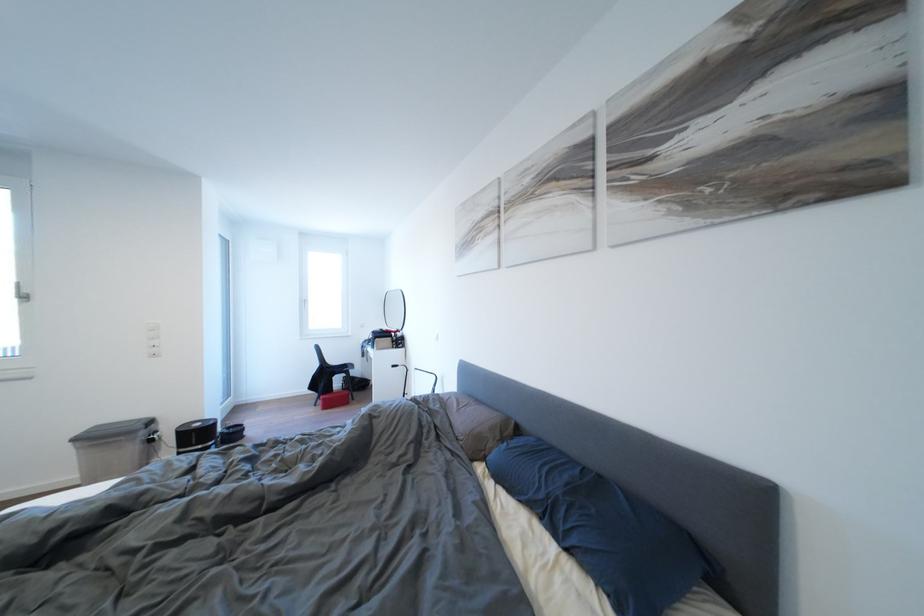
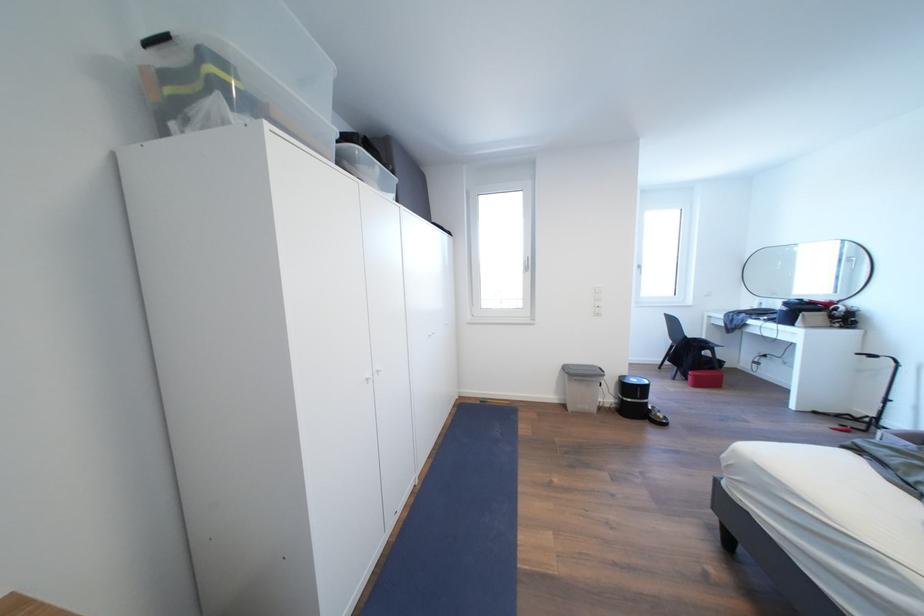
Find the pixel in the second image that matches point (205, 430) in the first image.

(641, 386)